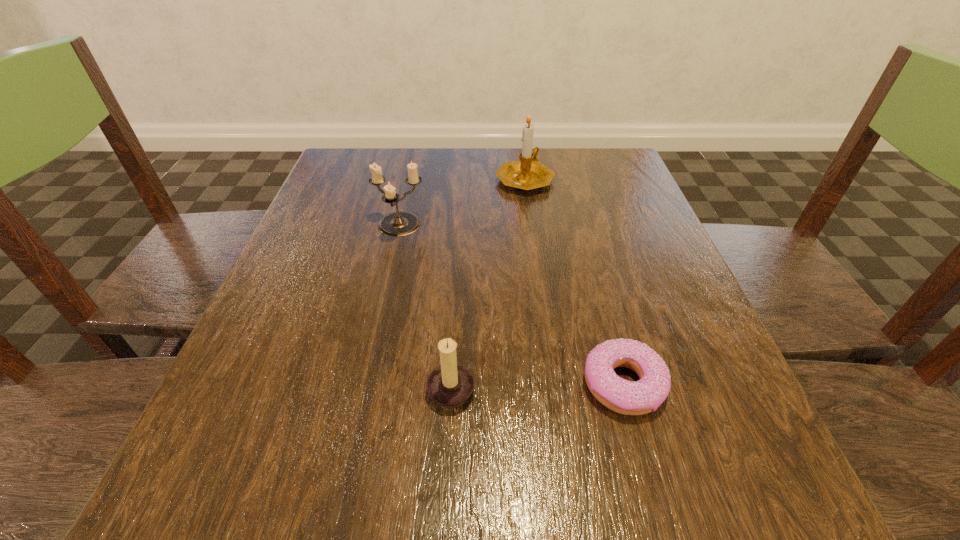
Where is `candle holder that is the second closest to the leftmost object`? candle holder that is the second closest to the leftmost object is located at coordinates (451, 384).

Image resolution: width=960 pixels, height=540 pixels. What are the coordinates of `candle holder that is the second closest to the doughnut` in the screenshot? It's located at (400, 223).

Identify the location of vacant region that satisfies the following two spatial constraints: 1. on the back side of the farthest candle holder; 2. on the left side of the third nearest object. (409, 179).

Where is `vacant point that satisfies the following two spatial constraints: 1. on the front side of the doughnut; 2. on the wick of the nearest candle holder`? This screenshot has width=960, height=540. vacant point that satisfies the following two spatial constraints: 1. on the front side of the doughnut; 2. on the wick of the nearest candle holder is located at coordinates (624, 386).

Locate an element on the screen. Image resolution: width=960 pixels, height=540 pixels. vacant region that satisfies the following two spatial constraints: 1. on the front side of the farthest candle holder; 2. on the wick of the third tallest object is located at coordinates (554, 386).

The width and height of the screenshot is (960, 540). Identify the location of free space that satisfies the following two spatial constraints: 1. on the front side of the shortest object; 2. on the right side of the leftmost candle holder. (364, 381).